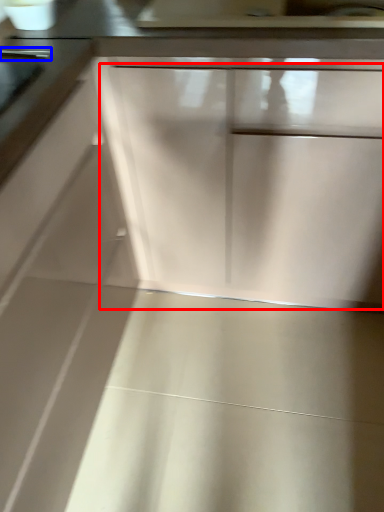
Question: Which point is closer to the camera, drawer (highlighted by a red box) or door handle (highlighted by a blue box)?

Choices:
 (A) drawer
 (B) door handle

Answer: (A)